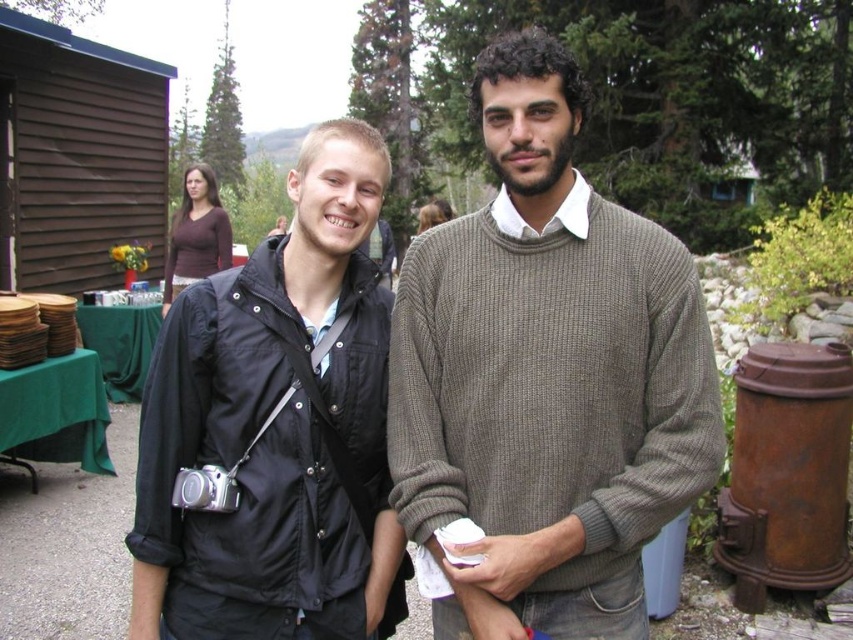
You are standing at the point with coordinates point (207, 266) and want to move towards the wooden structure on the left. Is the point point (606, 410) located between you and the wooden structure?

Point (606, 410) is closer to the viewer than point (207, 266), so yes, the point (606, 410) is between you and the wooden structure on the left.

You are at a party and need to decide which clothing item is taller between the knit brown sweater at center and the brown matte shirt at upper left. Which one should you choose?

The knit brown sweater at center is taller than the brown matte shirt at upper left, so you should choose the knit brown sweater at center.